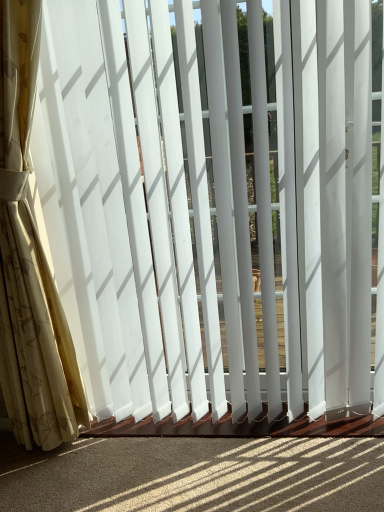
Identify the location of vacant area that lies to the right of white sheer curtain at left. The width and height of the screenshot is (384, 512). (160, 460).